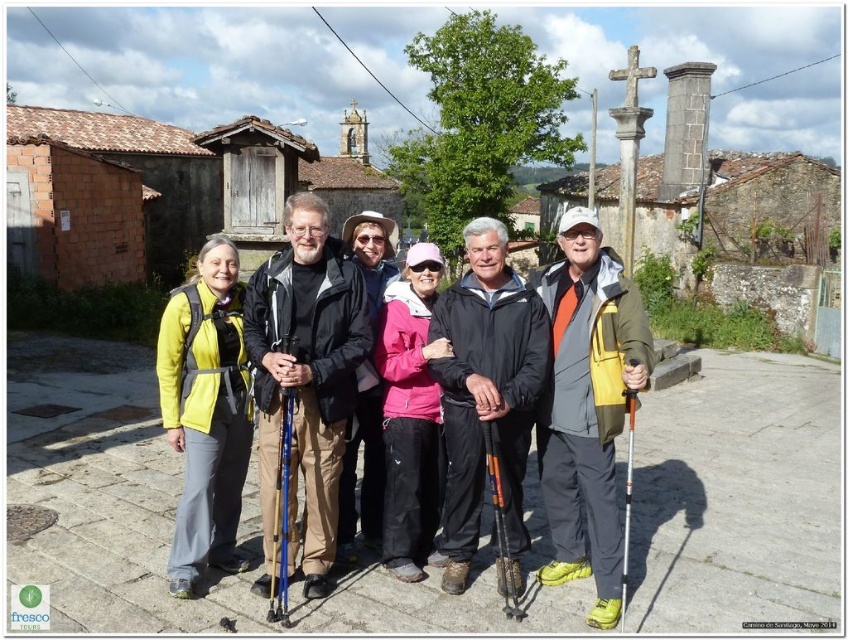
From the picture: Between matte yellow jacket at left and pink fabric jacket at center, which one has more height?

With more height is pink fabric jacket at center.

Is matte yellow jacket at left above pink fabric jacket at center?

Correct, matte yellow jacket at left is located above pink fabric jacket at center.

Where is `matte yellow jacket at left`? The width and height of the screenshot is (848, 640). matte yellow jacket at left is located at coordinates (205, 412).

Can you confirm if orange fabric jacket at center is smaller than pink fabric jacket at center?

Indeed, orange fabric jacket at center has a smaller size compared to pink fabric jacket at center.

Is orange fabric jacket at center to the right of pink fabric jacket at center from the viewer's perspective?

Correct, you'll find orange fabric jacket at center to the right of pink fabric jacket at center.

This screenshot has width=848, height=640. I want to click on orange fabric jacket at center, so click(587, 406).

The width and height of the screenshot is (848, 640). Find the location of `orange fabric jacket at center`. orange fabric jacket at center is located at coordinates (587, 406).

What do you see at coordinates (282, 515) in the screenshot? I see `blue plastic ski pole at center` at bounding box center [282, 515].

Does blue plastic ski pole at center appear on the right side of silver metallic ski pole at center?

No, blue plastic ski pole at center is not to the right of silver metallic ski pole at center.

Between point (282, 602) and point (634, 413), which one is positioned in front?

Point (282, 602)

You are a GUI agent. You are given a task and a screenshot of the screen. Output one action in this format:
    pyautogui.click(x=<x>, y=<y>)
    Task: Click on the blue plastic ski pole at center
    The width and height of the screenshot is (848, 640).
    Given the screenshot: What is the action you would take?
    pyautogui.click(x=282, y=515)